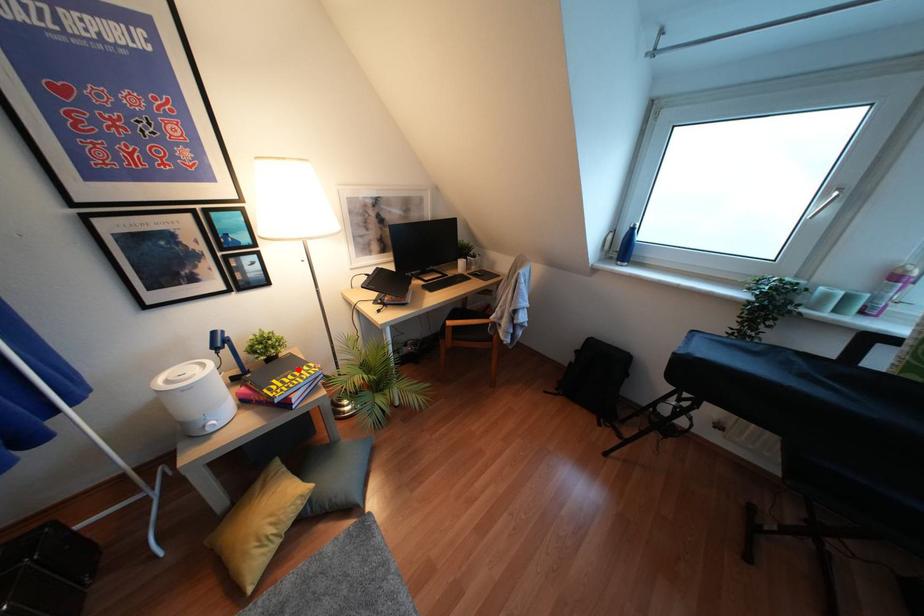
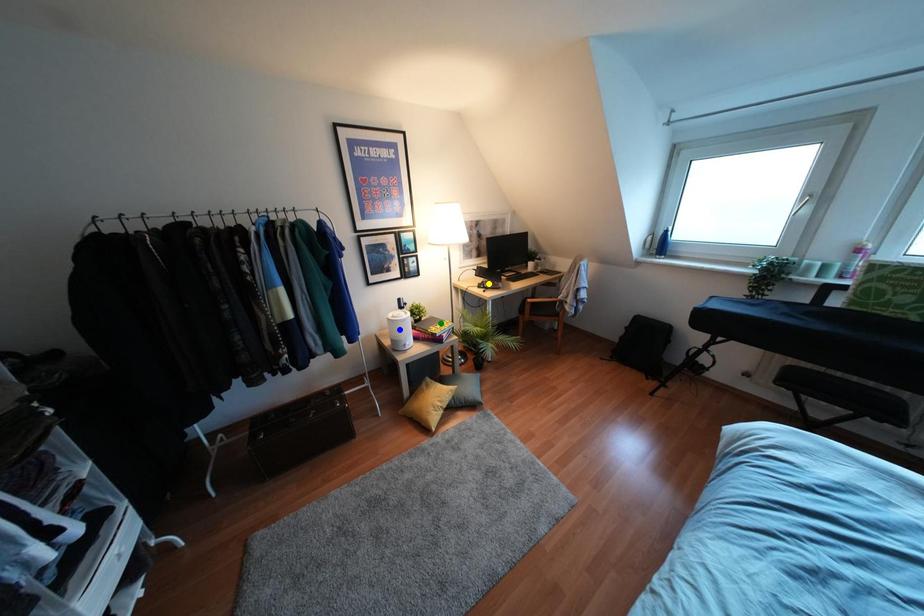
Question: I am providing you with two images of the same scene from different viewpoints. A red point is marked on the first image. You are given multiple points on the second image. Which mark in image 2 goes with the point in image 1?

Choices:
 (A) yellow point
 (B) blue point
 (C) green point

Answer: (C)